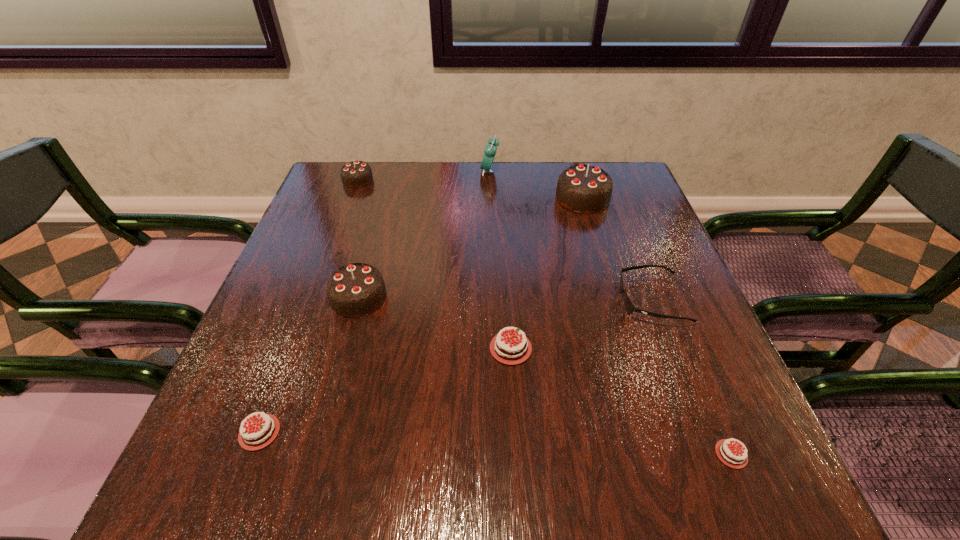
The image size is (960, 540). In order to click on the leftmost red chocolate cake in this screenshot , I will do `click(259, 434)`.

You are a GUI agent. You are given a task and a screenshot of the screen. Output one action in this format:
    pyautogui.click(x=<x>, y=<y>)
    Task: Click on the second shortest chocolate cake
    Image resolution: width=960 pixels, height=540 pixels.
    Given the screenshot: What is the action you would take?
    pyautogui.click(x=259, y=434)

At what (x,y) coordinates should I click in order to perform the action: click on the rightmost red chocolate cake. Please return your answer as a coordinate pair (x, y). Looking at the image, I should click on (731, 456).

The height and width of the screenshot is (540, 960). In order to click on the smallest red chocolate cake in this screenshot , I will do `click(731, 456)`.

This screenshot has width=960, height=540. In order to click on vacant space located 0.320m on the face of the alarm clock in this screenshot , I will do `click(374, 171)`.

Locate an element on the screen. free location located 0.220m on the face of the alarm clock is located at coordinates (407, 171).

Where is `free space located on the face of the alarm clock`? Image resolution: width=960 pixels, height=540 pixels. free space located on the face of the alarm clock is located at coordinates (368, 171).

Identify the location of free spot located 0.050m on the front of the tallest chocolate cake. Image resolution: width=960 pixels, height=540 pixels. (590, 226).

The width and height of the screenshot is (960, 540). I want to click on vacant space located 0.370m on the back of the second tallest chocolate cake, so click(x=389, y=188).

Find the location of `free location located on the front of the fourth tallest object`. free location located on the front of the fourth tallest object is located at coordinates click(319, 285).